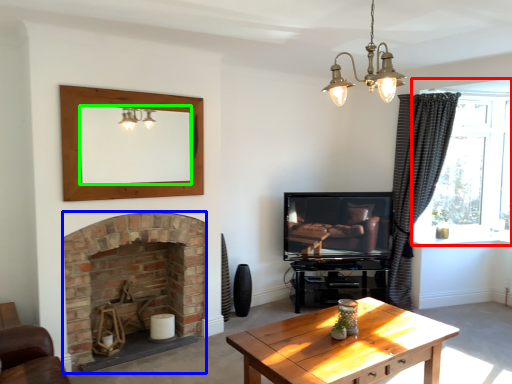
Question: Which object is positioned farthest from window (highlighted by a red box)? Select from fireplace (highlighted by a blue box) and mirror (highlighted by a green box).

Choices:
 (A) fireplace
 (B) mirror

Answer: (A)